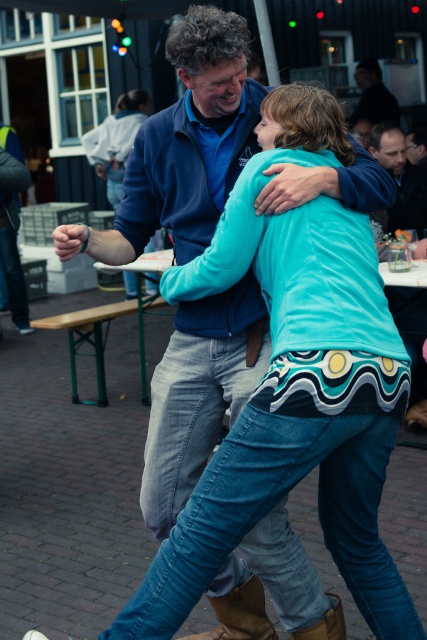
Question: Does brown leather boot at lower center appear on the right side of dark blue shirt at upper center?

Choices:
 (A) no
 (B) yes

Answer: (A)

Question: Which of the following is the closest to the observer?

Choices:
 (A) (108, 122)
 (B) (394, 131)
 (C) (395, 102)

Answer: (B)

Question: Estimate the real-world distances between objects in this image. Which object is closer to the brown leather boot at lower center?

Choices:
 (A) turquoise fabric jacket at center
 (B) dark blue fleece at upper right

Answer: (B)

Question: Considering the real-world distances, which object is farthest from the dark blue shirt at upper center?

Choices:
 (A) brown leather boot at lower center
 (B) turquoise fabric jacket at center
 (C) dark blue fleece at upper right

Answer: (A)

Question: Can you confirm if dark blue fleece at upper right is smaller than dark blue shirt at upper center?

Choices:
 (A) no
 (B) yes

Answer: (B)

Question: Can you confirm if dark blue fleece at upper right is smaller than dark blue shirt at upper center?

Choices:
 (A) yes
 (B) no

Answer: (A)